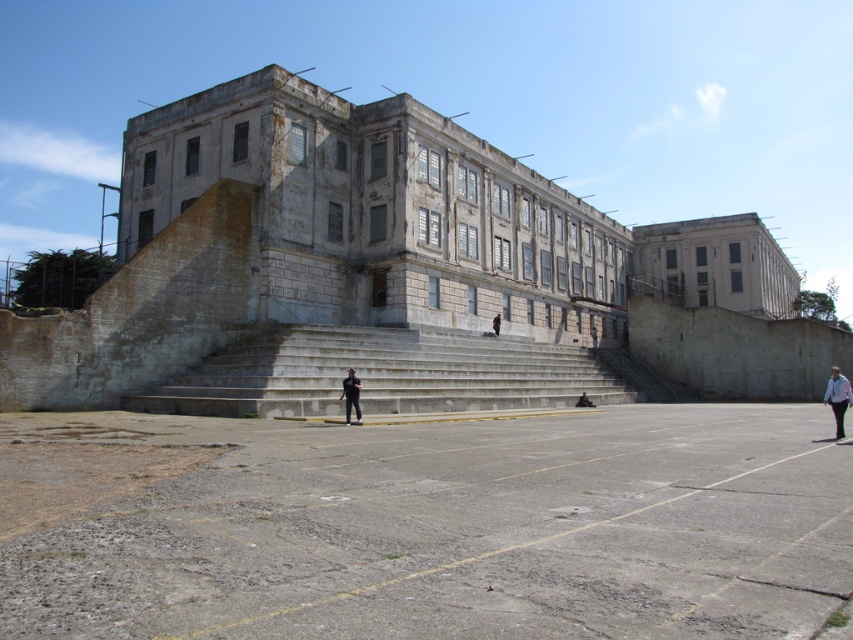
Question: Is white shirt at lower right to the right of black matte pants at center from the viewer's perspective?

Choices:
 (A) yes
 (B) no

Answer: (A)

Question: Does black matte pants at center have a greater width compared to black fabric at center?

Choices:
 (A) yes
 (B) no

Answer: (B)

Question: Can you confirm if concrete stairs at center is positioned to the right of black fabric at center?

Choices:
 (A) yes
 (B) no

Answer: (B)

Question: Estimate the real-world distances between objects in this image. Which object is farther from the black fabric at center?

Choices:
 (A) concrete stairs at center
 (B) white shirt at lower right
 (C) black matte pants at center

Answer: (C)

Question: Based on their relative distances, which object is farther from the white shirt at lower right?

Choices:
 (A) black matte pants at center
 (B) concrete stairs at center
 (C) black fabric at center

Answer: (A)

Question: Which point is closer to the camera?

Choices:
 (A) black fabric at center
 (B) black matte pants at center

Answer: (B)